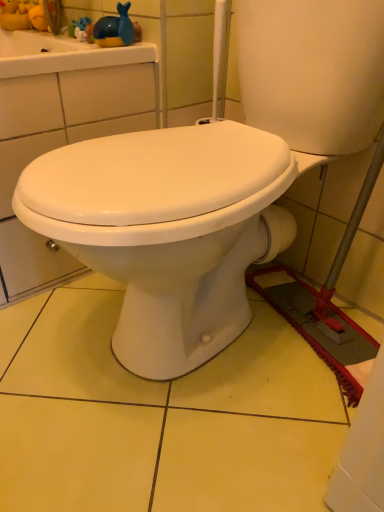
Identify the location of blue glossy whale at upper left. The height and width of the screenshot is (512, 384). (115, 29).

Describe the element at coordinates (115, 29) in the screenshot. This screenshot has height=512, width=384. I see `blue glossy whale at upper left` at that location.

The image size is (384, 512). In order to click on blue glossy whale at upper left in this screenshot , I will do `click(115, 29)`.